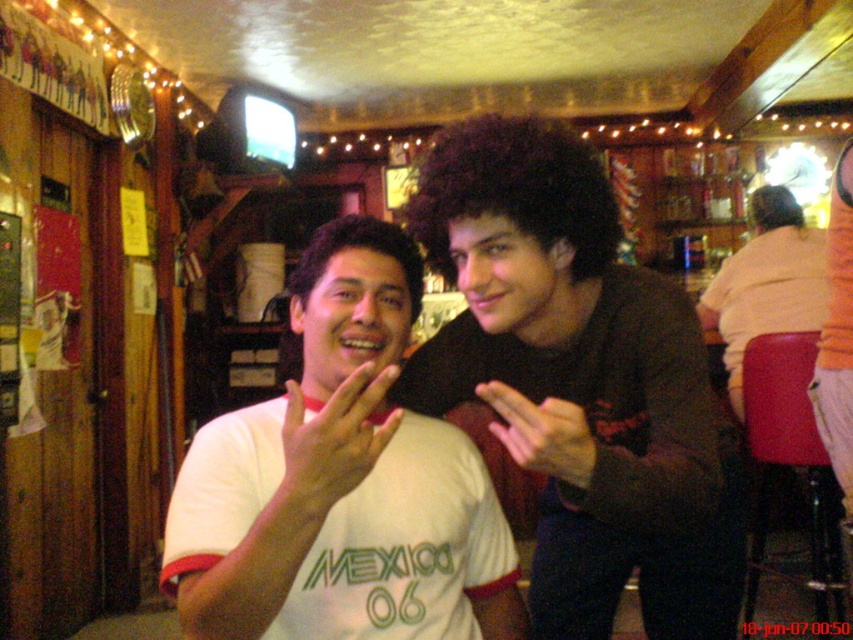
You are a photographer trying to capture a candid shot of the two people in the scene. You want to ensure that both the dark brown hair at center and the white matte hand at center are in focus. Given that your camera has a depth of field that can cover 12 inches, will both subjects be in focus?

The dark brown hair at center is 11.68 inches away from the white matte hand at center. Since the distance between them is within the 12 inches depth of field, both subjects will be in focus.

You are a photographer trying to capture a candid shot of the two people in the scene. Since you want to ensure both the dark brown hair at center and the pink matte hand at center are clearly visible in the frame, which object should you focus on first to ensure depth of field captures both?

The dark brown hair at center is taller than the pink matte hand at center. To ensure both are in focus, you should focus on the dark brown hair at center first, as it is farther away, allowing the depth of field to extend backward to the closer pink matte hand at center.

You are a photographer trying to capture the perfect shot of the dark brown hair at center and the white matte hand at center. To ensure both are in frame, you need to know their relative positions. Which object is positioned to the right of the other?

The dark brown hair at center is to the right of the white matte hand at center.